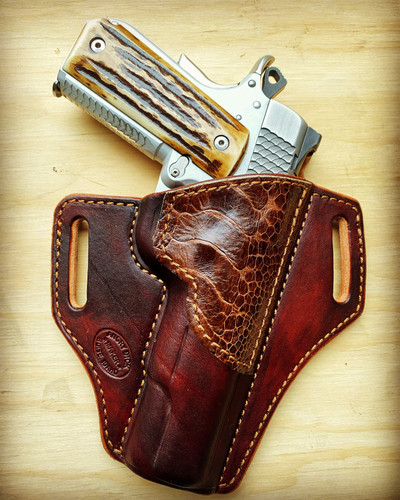
This screenshot has width=400, height=500. Find the location of `holder`. holder is located at coordinates (201, 382).